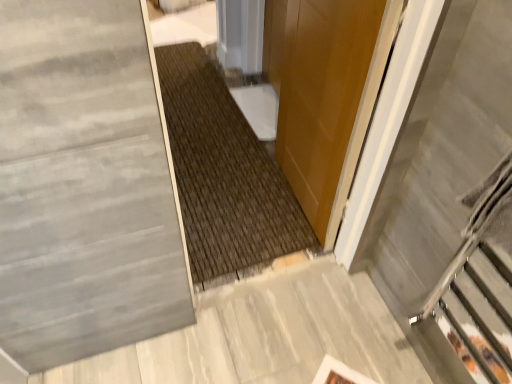
Question: Would you say glossy wood door at center is to the left or to the right of gray polished concrete at lower left in the picture?

Choices:
 (A) left
 (B) right

Answer: (B)

Question: Does point (328, 205) appear closer or farther from the camera than point (259, 340)?

Choices:
 (A) closer
 (B) farther

Answer: (B)

Question: Which of these objects is positioned closest to the metallic gray escalator at right?

Choices:
 (A) gray polished concrete at lower left
 (B) glossy wood door at center

Answer: (B)

Question: Which of these objects is positioned closest to the metallic gray escalator at right?

Choices:
 (A) glossy wood door at center
 (B) gray polished concrete at lower left

Answer: (A)